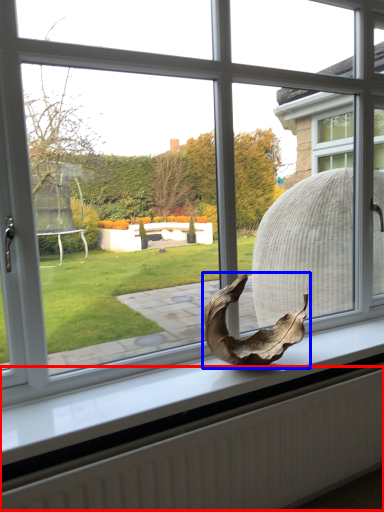
Question: Which object is further to the camera taking this photo, radiator (highlighted by a red box) or animal (highlighted by a blue box)?

Choices:
 (A) radiator
 (B) animal

Answer: (B)